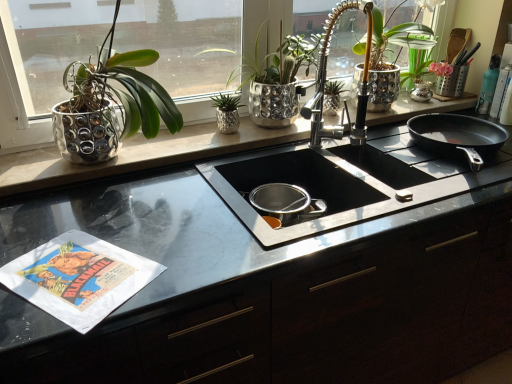
Question: Which direction should I rotate to look at shiny metallic pot at center, marked as the 2th houseplant in a right-to-left arrangement?

Choices:
 (A) right
 (B) left

Answer: (A)

Question: Is green metallic plant at center, which is the 2th houseplant in left-to-right order, wider than shiny metallic pot at center, marked as the 2th houseplant in a right-to-left arrangement?

Choices:
 (A) yes
 (B) no

Answer: (B)

Question: Does green metallic plant at center, which is the 2th houseplant in left-to-right order, have a lesser height compared to shiny metallic pot at center, marked as the 2th houseplant in a right-to-left arrangement?

Choices:
 (A) no
 (B) yes

Answer: (B)

Question: From a real-world perspective, is green metallic plant at center, which is the 2th houseplant in left-to-right order, positioned under shiny metallic pot at center, marked as the third houseplant in a left-to-right arrangement, based on gravity?

Choices:
 (A) yes
 (B) no

Answer: (A)

Question: From a real-world perspective, is green metallic plant at center, which is the 2th houseplant in left-to-right order, over shiny metallic pot at center, marked as the third houseplant in a left-to-right arrangement?

Choices:
 (A) yes
 (B) no

Answer: (B)

Question: Could you tell me if green metallic plant at center, which is the 2th houseplant in left-to-right order, is facing shiny metallic pot at center, marked as the 2th houseplant in a right-to-left arrangement?

Choices:
 (A) no
 (B) yes

Answer: (B)

Question: Considering the relative sizes of green metallic plant at center, which is the 2th houseplant in left-to-right order, and shiny metallic pot at center, marked as the third houseplant in a left-to-right arrangement, in the image provided, is green metallic plant at center, which is the 2th houseplant in left-to-right order, smaller than shiny metallic pot at center, marked as the third houseplant in a left-to-right arrangement,?

Choices:
 (A) yes
 (B) no

Answer: (A)

Question: From the image's perspective, is black glossy countertop at center beneath shiny metallic pot at center, marked as the 2th houseplant in a right-to-left arrangement?

Choices:
 (A) no
 (B) yes

Answer: (B)

Question: Does black glossy countertop at center appear on the right side of shiny metallic pot at center, marked as the 2th houseplant in a right-to-left arrangement?

Choices:
 (A) yes
 (B) no

Answer: (A)

Question: Considering the relative sizes of black glossy countertop at center and shiny metallic pot at center, marked as the third houseplant in a left-to-right arrangement, in the image provided, is black glossy countertop at center wider than shiny metallic pot at center, marked as the third houseplant in a left-to-right arrangement,?

Choices:
 (A) no
 (B) yes

Answer: (B)

Question: Is black glossy countertop at center taller than shiny metallic pot at center, marked as the third houseplant in a left-to-right arrangement?

Choices:
 (A) yes
 (B) no

Answer: (A)

Question: From a real-world perspective, is black glossy countertop at center under shiny metallic pot at center, marked as the third houseplant in a left-to-right arrangement?

Choices:
 (A) yes
 (B) no

Answer: (A)

Question: From the image's perspective, is black glossy countertop at center located above shiny metallic pot at center, marked as the third houseplant in a left-to-right arrangement?

Choices:
 (A) yes
 (B) no

Answer: (B)

Question: Can you confirm if shiny metallic plant at left, which appears as the first houseplant when viewed from the left, is taller than black glossy countertop at center?

Choices:
 (A) no
 (B) yes

Answer: (A)